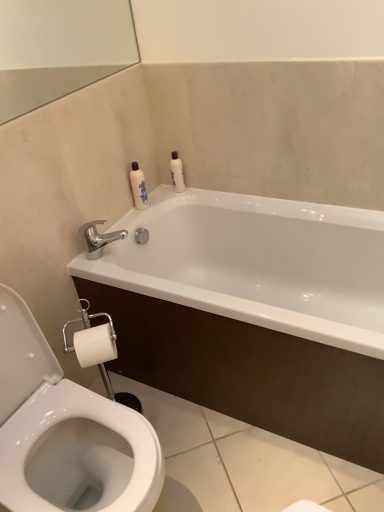
Identify the location of vacant space positioned to the left of white glossy bottle at upper right, arranged as the first toiletry when viewed from the right. (165, 192).